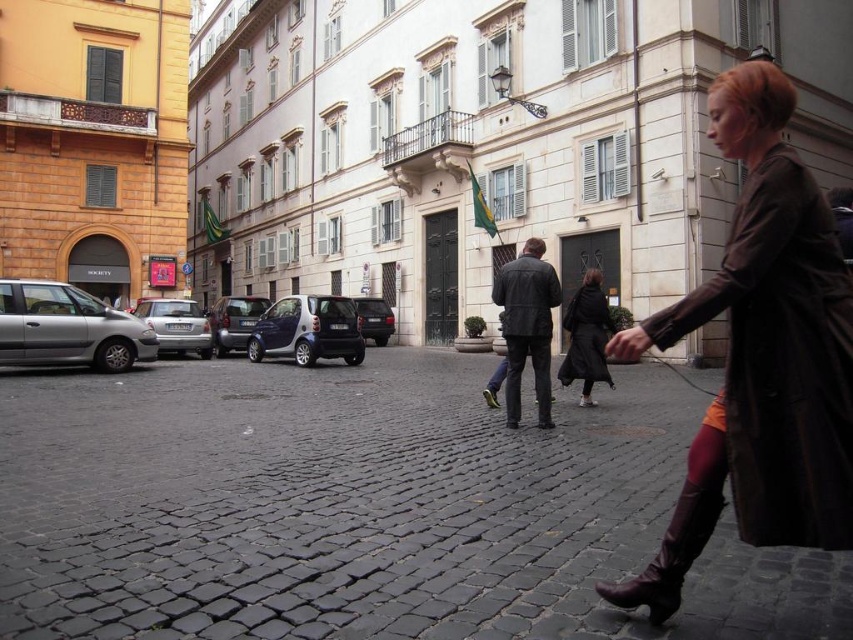
Is the position of brown matte coat at right less distant than that of silver metallic car at left?

Yes, it is.

Consider the image. Does brown matte coat at right appear on the right side of silver metallic car at left?

Indeed, brown matte coat at right is positioned on the right side of silver metallic car at left.

The width and height of the screenshot is (853, 640). Describe the element at coordinates (780, 358) in the screenshot. I see `brown matte coat at right` at that location.

Locate an element on the screen. The image size is (853, 640). brown matte coat at right is located at coordinates (780, 358).

Between point (787, 96) and point (593, 280), which one is positioned behind?

The point (593, 280) is behind.

What do you see at coordinates (758, 92) in the screenshot?
I see `blonde hair at upper right` at bounding box center [758, 92].

Where is `blonde hair at upper right`? The width and height of the screenshot is (853, 640). blonde hair at upper right is located at coordinates click(758, 92).

Which of these two, silver metallic van at left or dark brown leather jacket at center, stands taller?

With more height is dark brown leather jacket at center.

Who is more forward, (119, 344) or (508, 362)?

Positioned in front is point (508, 362).

I want to click on silver metallic van at left, so click(x=67, y=328).